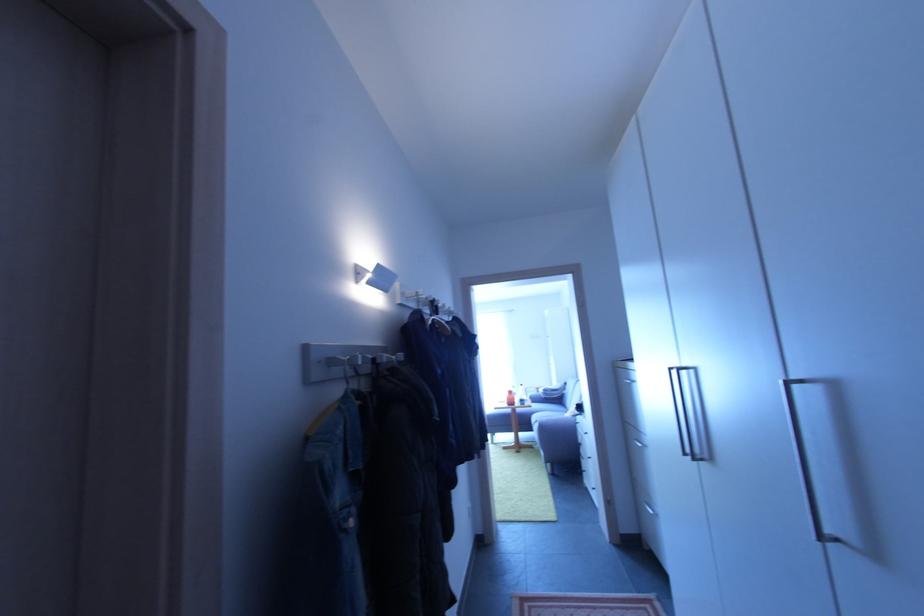
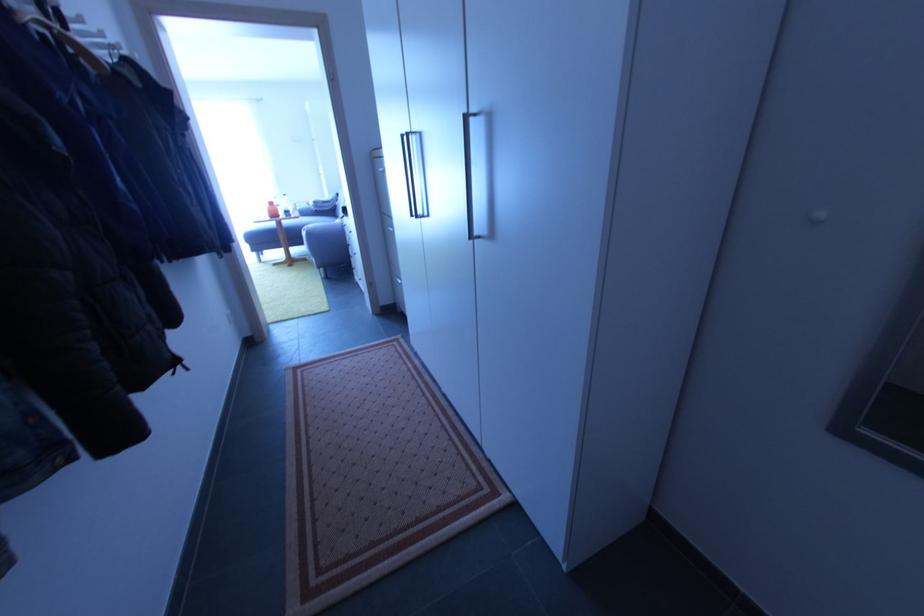
Where in the second image is the point corresponding to pixel 540 402 from the first image?

(310, 216)